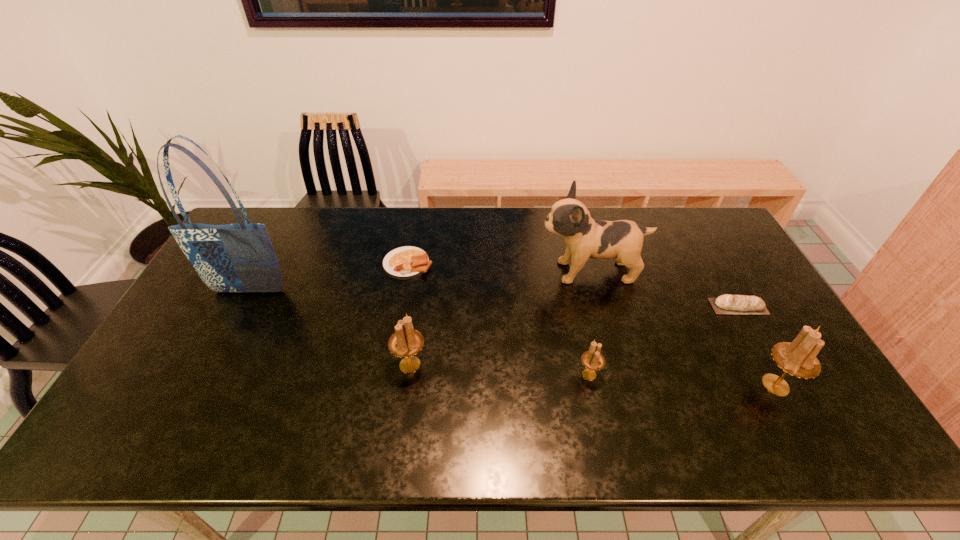
Please point a spot to add another candle holder on the left. Please provide its 2D coordinates. Your answer should be formatted as a tuple, i.e. [(x, y)], where the tuple contains the x and y coordinates of a point satisfying the conditions above.

[(237, 355)]